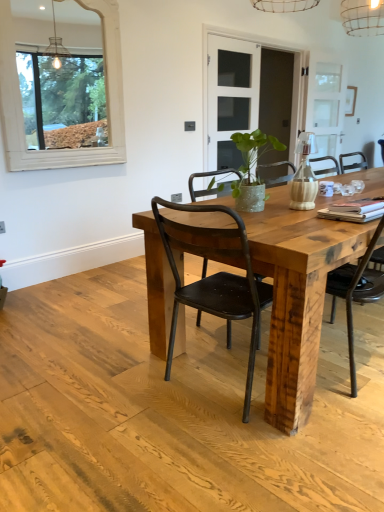
The width and height of the screenshot is (384, 512). I want to click on free space in front of green textured vase at center, so click(260, 223).